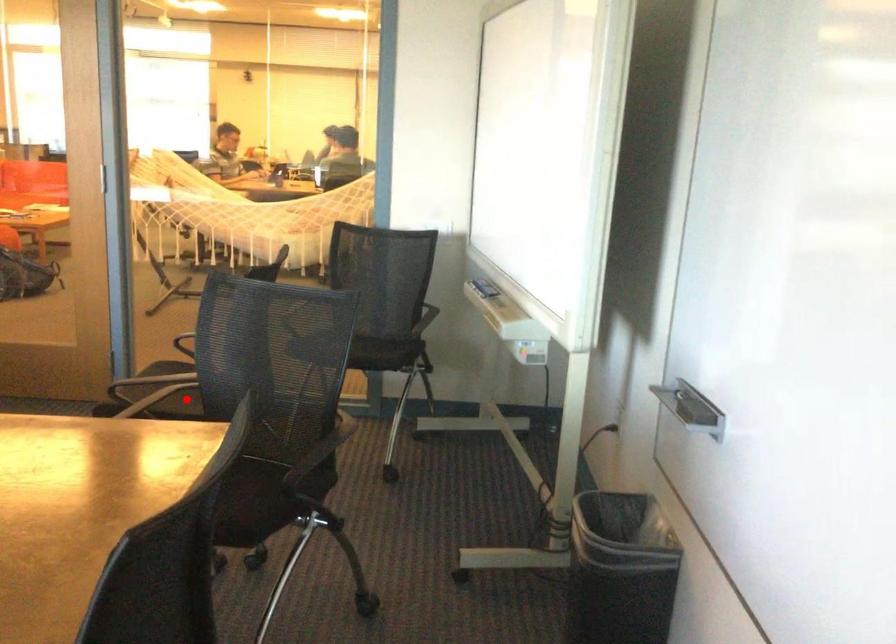
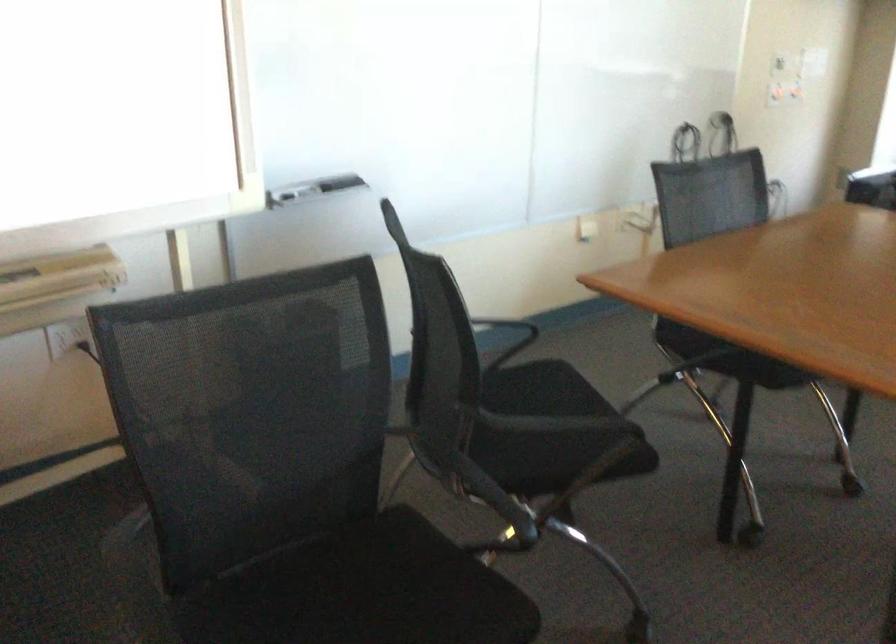
Find the pixel in the second image that matches the highlighted location in the first image.

(363, 592)